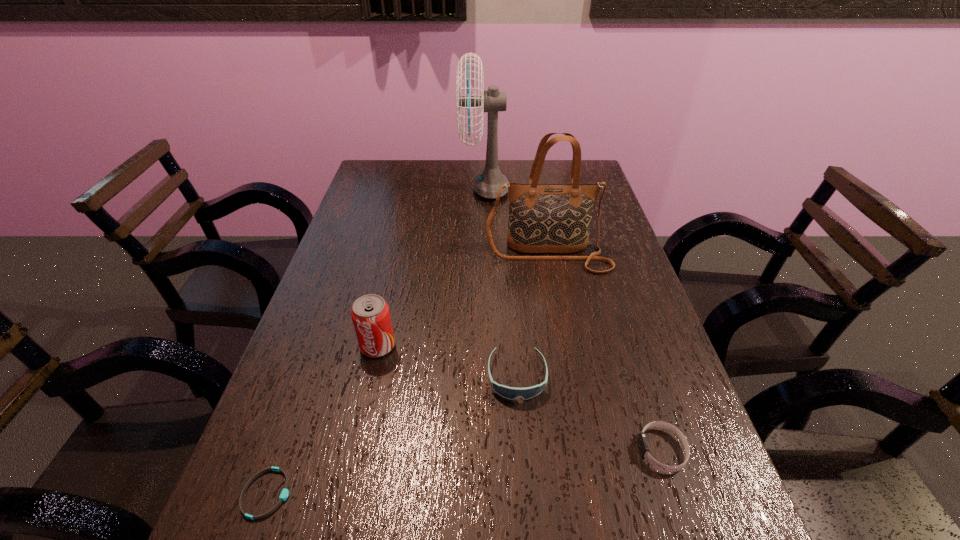
Image resolution: width=960 pixels, height=540 pixels. I want to click on fan, so click(x=487, y=184).

Find the location of a particular element. The height and width of the screenshot is (540, 960). the tallest object is located at coordinates pos(487,184).

The width and height of the screenshot is (960, 540). In order to click on handbag in this screenshot , I will do `click(548, 218)`.

You are a GUI agent. You are given a task and a screenshot of the screen. Output one action in this format:
    pyautogui.click(x=<x>, y=<y>)
    Task: Click on the fifth nearest object
    
    Given the screenshot: What is the action you would take?
    pyautogui.click(x=548, y=218)

Find the location of a particular element. the fifth object from right to left is located at coordinates (370, 314).

Image resolution: width=960 pixels, height=540 pixels. Find the location of `soda can`. soda can is located at coordinates (370, 314).

Locate an element on the screen. The width and height of the screenshot is (960, 540). goggles is located at coordinates (511, 393).

Locate an element on the screen. the taller wristband is located at coordinates (642, 443).

Locate an element on the screen. The height and width of the screenshot is (540, 960). the right wristband is located at coordinates (642, 443).

At what (x,y) coordinates should I click in order to perform the action: click on the left wristband. Please return your answer as a coordinate pair (x, y). The height and width of the screenshot is (540, 960). Looking at the image, I should click on (284, 494).